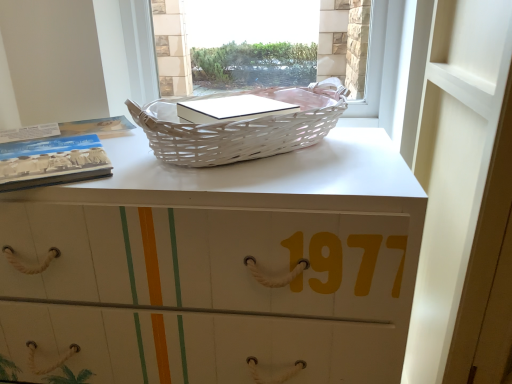
Question: Are white matte desk at center and white wicker picnic basket at upper center making contact?

Choices:
 (A) yes
 (B) no

Answer: (B)

Question: Can you confirm if white matte desk at center is bigger than white wicker picnic basket at upper center?

Choices:
 (A) yes
 (B) no

Answer: (A)

Question: From the image's perspective, is white matte desk at center under white wicker picnic basket at upper center?

Choices:
 (A) yes
 (B) no

Answer: (A)

Question: From the image's perspective, is white matte desk at center on white wicker picnic basket at upper center?

Choices:
 (A) yes
 (B) no

Answer: (B)

Question: From a real-world perspective, does white matte desk at center stand above white wicker picnic basket at upper center?

Choices:
 (A) yes
 (B) no

Answer: (B)

Question: Can you confirm if white matte desk at center is smaller than white wicker picnic basket at upper center?

Choices:
 (A) yes
 (B) no

Answer: (B)

Question: Considering the relative sizes of white wicker picnic basket at upper center and white wicker basket at upper center in the image provided, is white wicker picnic basket at upper center wider than white wicker basket at upper center?

Choices:
 (A) yes
 (B) no

Answer: (A)

Question: Is white wicker basket at upper center a part of white wicker picnic basket at upper center?

Choices:
 (A) yes
 (B) no

Answer: (B)

Question: Considering the relative sizes of white wicker picnic basket at upper center and white wicker basket at upper center in the image provided, is white wicker picnic basket at upper center taller than white wicker basket at upper center?

Choices:
 (A) no
 (B) yes

Answer: (A)

Question: Does white wicker picnic basket at upper center appear on the right side of white wicker basket at upper center?

Choices:
 (A) no
 (B) yes

Answer: (A)

Question: Is white wicker picnic basket at upper center in front of white wicker basket at upper center?

Choices:
 (A) yes
 (B) no

Answer: (A)

Question: Is white wicker picnic basket at upper center looking in the opposite direction of white wicker basket at upper center?

Choices:
 (A) no
 (B) yes

Answer: (B)

Question: Does white matte desk at center have a smaller size compared to white wicker basket at upper center?

Choices:
 (A) no
 (B) yes

Answer: (A)